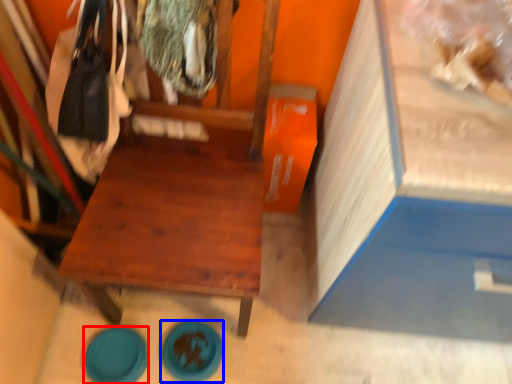
Question: Which object appears farthest to the camera in this image, plate (highlighted by a red box) or plate (highlighted by a blue box)?

Choices:
 (A) plate
 (B) plate

Answer: (B)